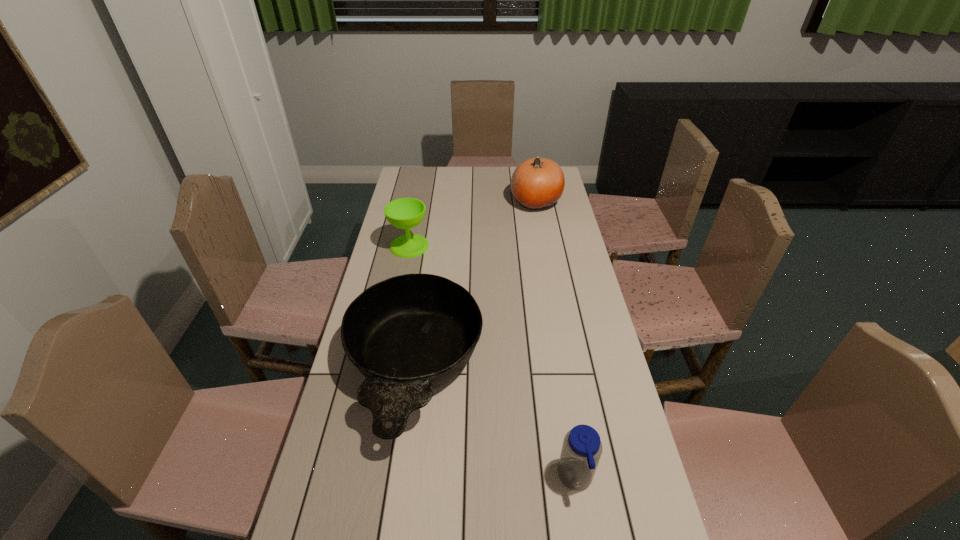
This screenshot has height=540, width=960. I want to click on free region located 0.090m with the handle extending from the side of the shortest object, so click(x=396, y=497).

This screenshot has height=540, width=960. I want to click on object present at the far edge, so click(537, 183).

Identify the location of wineglass situated at the left edge. (405, 213).

I want to click on frying pan that is at the left edge, so click(409, 334).

Find the location of a particular element. The width and height of the screenshot is (960, 540). pumpkin situated at the right edge is located at coordinates (537, 183).

The image size is (960, 540). Identify the location of water bottle that is at the right edge. (582, 448).

In order to click on object situated at the far right corner in this screenshot , I will do `click(537, 183)`.

Locate an element on the screen. This screenshot has height=540, width=960. vacant space at the left edge of the desktop is located at coordinates (400, 261).

This screenshot has height=540, width=960. In order to click on vacant space at the right edge of the desktop in this screenshot , I will do `click(550, 249)`.

Locate an element on the screen. The height and width of the screenshot is (540, 960). free spot between the water bottle and the frying pan is located at coordinates (494, 424).